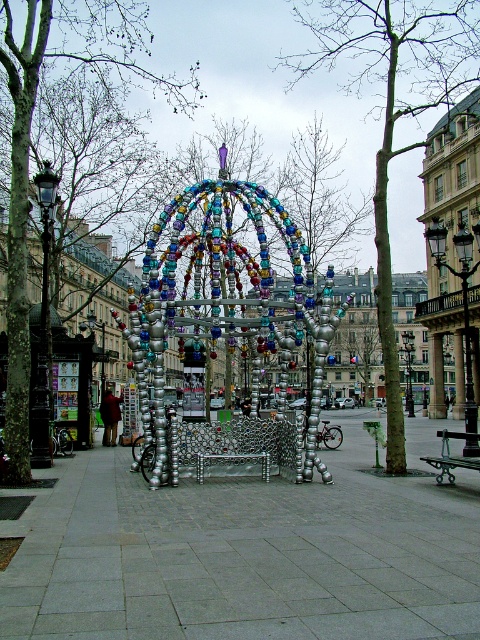
Image resolution: width=480 pixels, height=640 pixels. What do you see at coordinates (245, 554) in the screenshot? I see `silver metallic bench at center` at bounding box center [245, 554].

Is the position of silver metallic bench at center less distant than that of smooth bark tree at center?

Yes, silver metallic bench at center is closer to the viewer.

Who is more forward, (287, 481) or (359, 60)?

Positioned in front is point (287, 481).

The height and width of the screenshot is (640, 480). What are the coordinates of `silver metallic bench at center` in the screenshot? It's located at (245, 554).

Does silver metallic bench at center have a lesser height compared to silver metallic sculpture at center?

Yes.

Between silver metallic bench at center and silver metallic sculpture at center, which one appears on the left side from the viewer's perspective?

From the viewer's perspective, silver metallic sculpture at center appears more on the left side.

Where is `silver metallic bench at center`? The height and width of the screenshot is (640, 480). silver metallic bench at center is located at coordinates click(245, 554).

Is smooth bark tree at center bigger than silver metallic sculpture at center?

Yes, smooth bark tree at center is bigger than silver metallic sculpture at center.

Who is more distant from viewer, (444, 28) or (113, 6)?

Point (113, 6)

The width and height of the screenshot is (480, 640). Find the location of `smooth bark tree at center`. smooth bark tree at center is located at coordinates tap(393, 109).